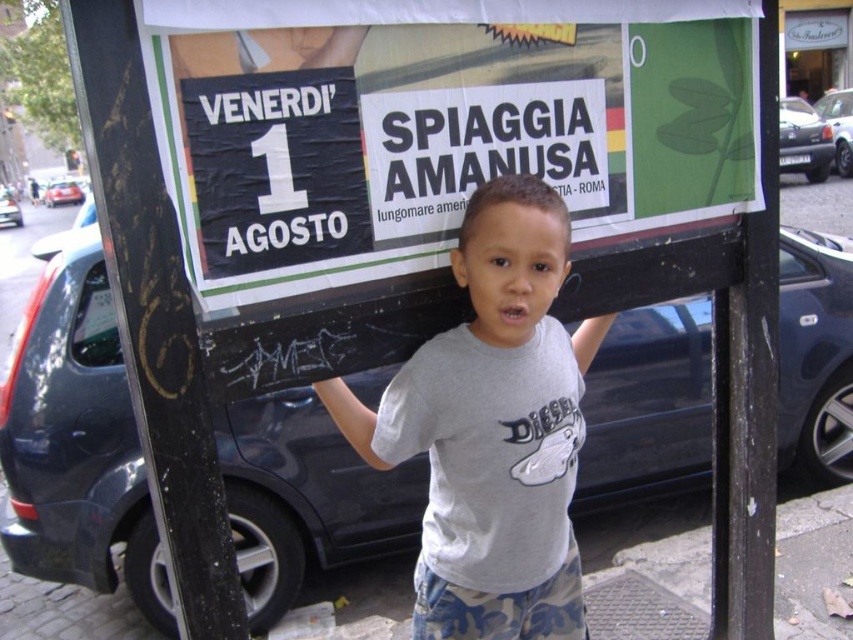
Is metallic blue car at center closer to camera compared to metallic silver car at right?

Yes, it is.

Based on the photo, does metallic blue car at center lie behind metallic silver car at right?

No, it is not.

Find the location of a particular element. Image resolution: width=853 pixels, height=640 pixels. metallic blue car at center is located at coordinates (76, 438).

This screenshot has height=640, width=853. Describe the element at coordinates (76, 438) in the screenshot. I see `metallic blue car at center` at that location.

Is metallic blue car at center wider than metallic blue car at left?

No, metallic blue car at center is not wider than metallic blue car at left.

Which is behind, point (665, 404) or point (10, 204)?

Point (10, 204)

Where is `metallic blue car at center`? The image size is (853, 640). metallic blue car at center is located at coordinates (76, 438).

Does gray cotton shirt at center have a greater width compared to metallic silver car at left?

No, gray cotton shirt at center is not wider than metallic silver car at left.

Based on the photo, between gray cotton shirt at center and metallic silver car at left, which one appears on the left side from the viewer's perspective?

metallic silver car at left is more to the left.

In order to click on gray cotton shirt at center in this screenshot , I will do `click(492, 429)`.